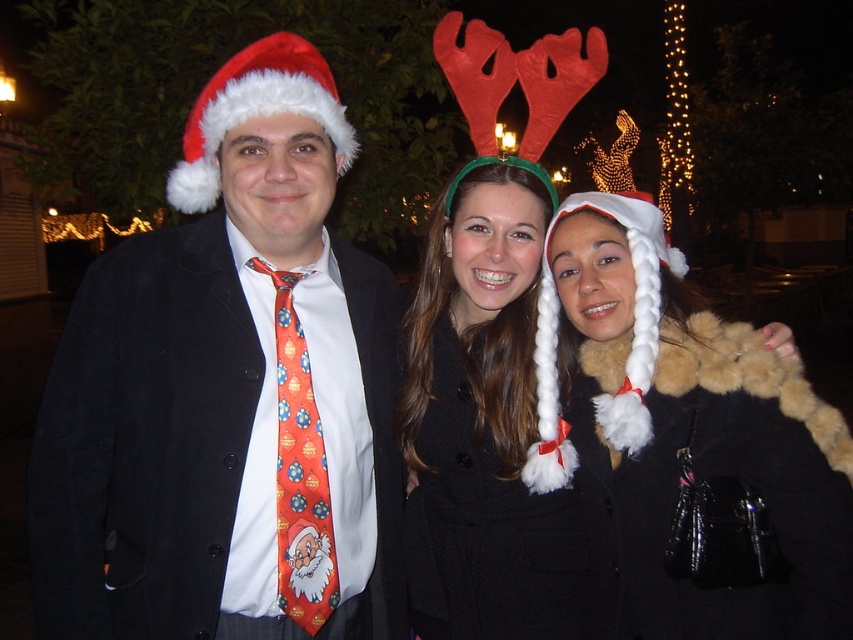
You are a GUI agent. You are given a task and a screenshot of the screen. Output one action in this format:
    pyautogui.click(x=<x>, y=<y>)
    Task: Click on the matte black coat at center
    
    Given the screenshot: What is the action you would take?
    pyautogui.click(x=228, y=396)

At what (x,y) coordinates should I click in order to perform the action: click on matte black coat at center. Please return your answer as a coordinate pair (x, y). This screenshot has width=853, height=640. Looking at the image, I should click on (228, 396).

Is fuzzy black coat at center below black wool coat at center?

No.

Between fuzzy black coat at center and black wool coat at center, which one has more height?

fuzzy black coat at center is taller.

Where is `fuzzy black coat at center`? The image size is (853, 640). fuzzy black coat at center is located at coordinates (683, 445).

Is point (94, 637) positioned after point (610, 636)?

That is False.

Is matte black coat at center wider than fuzzy black coat at center?

Yes, matte black coat at center is wider than fuzzy black coat at center.

Between point (381, 426) and point (827, 612), which one is positioned in front?

Point (827, 612) is more forward.

The image size is (853, 640). I want to click on matte black coat at center, so click(228, 396).